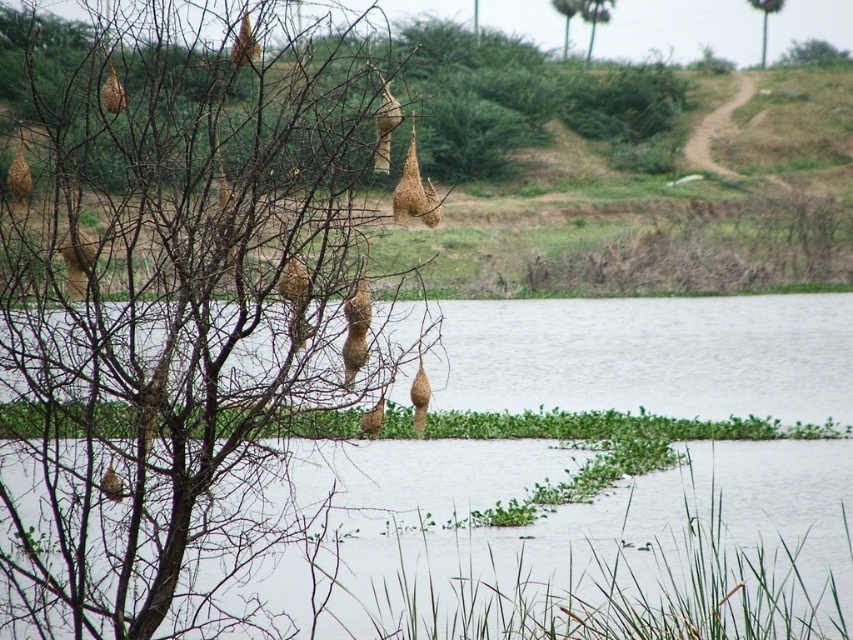
Question: Which point is farther to the camera?

Choices:
 (A) (599, 4)
 (B) (769, 10)
 (C) (577, 4)
 (D) (604, 324)

Answer: (B)

Question: Does brown woven nest at left have a greater width compared to brown woven nests at upper left?

Choices:
 (A) no
 (B) yes

Answer: (B)

Question: Which point is farther to the camera?

Choices:
 (A) brown woven nest at upper center
 (B) green leafy tree at upper right
 (C) brown woven nests at upper left
 (D) green leafy tree at upper center

Answer: (B)

Question: Can you confirm if brown woven nest at upper center is positioned to the left of green leafy tree at upper right?

Choices:
 (A) yes
 (B) no

Answer: (A)

Question: Considering the real-world distances, which object is closest to the green leafy tree at upper center?

Choices:
 (A) green leafy tree at upper right
 (B) brown woven nest at left
 (C) brown woven nest at upper center

Answer: (C)

Question: Is green leafy tree at upper right bigger than green leafy tree at upper center?

Choices:
 (A) yes
 (B) no

Answer: (A)